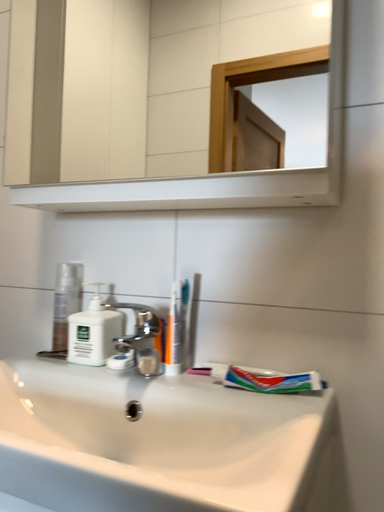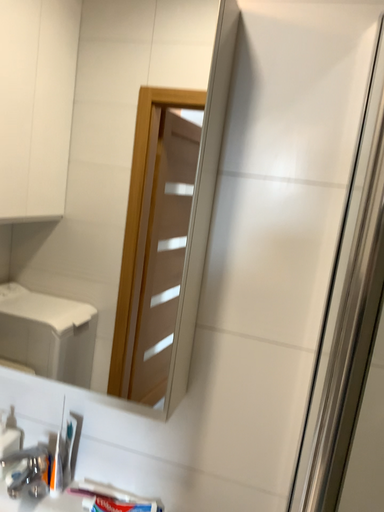
Question: Which way did the camera rotate in the video?

Choices:
 (A) rotated downward
 (B) rotated upward

Answer: (A)